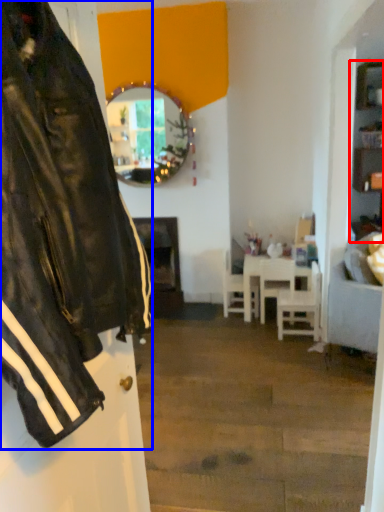
Question: Which object is closer to the camera taking this photo, cabinetry (highlighted by a red box) or jacket (highlighted by a blue box)?

Choices:
 (A) cabinetry
 (B) jacket

Answer: (B)